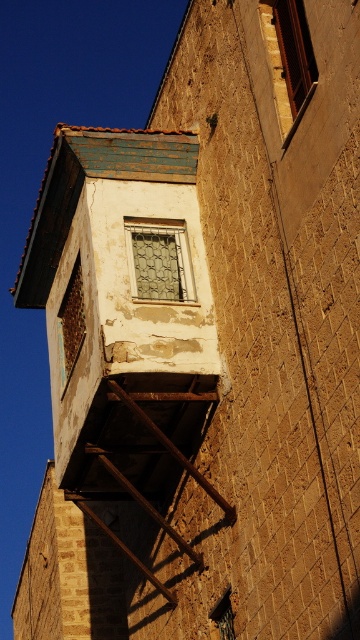
Question: Does rusty metal fire escape at lower center lie behind rusty metal window at center?

Choices:
 (A) yes
 (B) no

Answer: (B)

Question: Is rusty metal fire escape at lower left to the left of rusty metal window at center from the viewer's perspective?

Choices:
 (A) no
 (B) yes

Answer: (A)

Question: Which point appears farthest from the camera in this image?

Choices:
 (A) (214, 371)
 (B) (83, 294)

Answer: (B)

Question: Which object appears closest to the camera in this image?

Choices:
 (A) rusty metal window at center
 (B) rusty metal fire escape at lower center

Answer: (B)

Question: Does rusty metal fire escape at lower left appear under rusty metal window at center?

Choices:
 (A) yes
 (B) no

Answer: (B)

Question: Which object is positioned closest to the rusty metal fire escape at lower left?

Choices:
 (A) rusty metal window at center
 (B) rusty metal fire escape at lower center

Answer: (B)